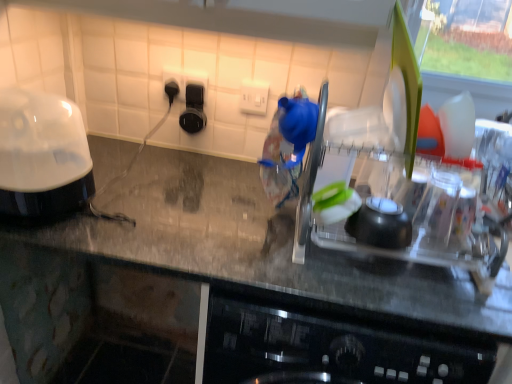
You are a GUI agent. You are given a task and a screenshot of the screen. Output one action in this format:
    pyautogui.click(x=<x>, y=<y>)
    Task: Click on the transparent plastic dish rack at center
    
    Given the screenshot: What is the action you would take?
    pyautogui.click(x=264, y=250)

The image size is (512, 384). What are the coordinates of `countertop that appears below the black plastic outlet at upper center, which ranks as the first electric outlet in left-to-right order (from a real-world perspective)` in the screenshot? It's located at (264, 250).

Is black plastic outlet at upper center, which ranks as the first electric outlet in left-to-right order, situated inside transparent plastic dish rack at center or outside?

black plastic outlet at upper center, which ranks as the first electric outlet in left-to-right order, exists outside the volume of transparent plastic dish rack at center.

Which is closer, (177, 76) or (262, 244)?

The point (262, 244) is in front.

Consider the image. Is black plastic outlet at upper center, which ranks as the first electric outlet in left-to-right order, facing towards transparent plastic dish rack at center?

No, black plastic outlet at upper center, which ranks as the first electric outlet in left-to-right order, is not turned towards transparent plastic dish rack at center.

Do you think black plastic outlet at upper center, which ranks as the first electric outlet in left-to-right order, is within clear plastic dish rack at center, or outside of it?

black plastic outlet at upper center, which ranks as the first electric outlet in left-to-right order, is spatially situated outside clear plastic dish rack at center.

How much distance is there between black plastic outlet at upper center, the second electric outlet viewed from the right, and clear plastic dish rack at center?

black plastic outlet at upper center, the second electric outlet viewed from the right, is 26.81 inches away from clear plastic dish rack at center.

Relative to clear plastic dish rack at center, is black plastic outlet at upper center, the second electric outlet viewed from the right, in front or behind?

In the image, black plastic outlet at upper center, the second electric outlet viewed from the right, appears behind clear plastic dish rack at center.

From a real-world perspective, which is physically below, black plastic outlet at upper center, the second electric outlet viewed from the right, or clear plastic dish rack at center?

clear plastic dish rack at center, from a real-world perspective.

In the image, is black glossy food processor at left positioned in front of or behind white plastic electric outlet at center, placed as the first electric outlet when sorted from right to left?

black glossy food processor at left is in front of white plastic electric outlet at center, placed as the first electric outlet when sorted from right to left.

Is black glossy food processor at left taller or shorter than white plastic electric outlet at center, placed as the first electric outlet when sorted from right to left?

Considering their sizes, black glossy food processor at left has more height than white plastic electric outlet at center, placed as the first electric outlet when sorted from right to left.

Looking at this image, choose the correct answer: Is black glossy food processor at left inside white plastic electric outlet at center, which is counted as the 2th electric outlet, starting from the left, or outside it?

black glossy food processor at left is spatially situated outside white plastic electric outlet at center, which is counted as the 2th electric outlet, starting from the left.

How many degrees apart are the facing directions of black glossy food processor at left and white plastic electric outlet at center, placed as the first electric outlet when sorted from right to left?

The angular difference between black glossy food processor at left and white plastic electric outlet at center, placed as the first electric outlet when sorted from right to left, is 0.51 degrees.

Who is bigger, white plastic electric outlet at center, placed as the first electric outlet when sorted from right to left, or clear plastic dish rack at center?

With larger size is clear plastic dish rack at center.

Between white plastic electric outlet at center, placed as the first electric outlet when sorted from right to left, and clear plastic dish rack at center, which one has more height?

Standing taller between the two is clear plastic dish rack at center.

Is white plastic electric outlet at center, which is counted as the 2th electric outlet, starting from the left, wider than clear plastic dish rack at center?

Incorrect, the width of white plastic electric outlet at center, which is counted as the 2th electric outlet, starting from the left, does not surpass that of clear plastic dish rack at center.

Looking at this image, from a real-world perspective, is white plastic electric outlet at center, which is counted as the 2th electric outlet, starting from the left, above or below transparent plastic dish rack at center?

From a real-world perspective, white plastic electric outlet at center, which is counted as the 2th electric outlet, starting from the left, is physically above transparent plastic dish rack at center.

Which is behind, point (259, 98) or point (234, 234)?

The point (259, 98) is farther from the camera.

Is black glossy food processor at left smaller than clear plastic dish rack at center?

Yes, black glossy food processor at left is smaller than clear plastic dish rack at center.

Does black glossy food processor at left turn towards clear plastic dish rack at center?

No, black glossy food processor at left is not turned towards clear plastic dish rack at center.

Locate an element on the screen. home appliance behind the clear plastic dish rack at center is located at coordinates (42, 155).

Which is behind, point (58, 207) or point (470, 237)?

The point (58, 207) is farther.

How different are the orientations of black glossy food processor at left and transparent plastic dish rack at center in degrees?

They differ by 0.846 degrees in their facing directions.

From a real-world perspective, is black glossy food processor at left positioned under transparent plastic dish rack at center based on gravity?

No, from a real-world perspective, black glossy food processor at left is not beneath transparent plastic dish rack at center.

Which of these two, black glossy food processor at left or transparent plastic dish rack at center, is thinner?

black glossy food processor at left.

Where is `the 1st electric outlet above the transparent plastic dish rack at center (from a real-world perspective)`? The height and width of the screenshot is (384, 512). the 1st electric outlet above the transparent plastic dish rack at center (from a real-world perspective) is located at coordinates (186, 79).

From the clear plastic dish rack at center, count the 2nd electric outlet to the left and point to it. Please provide its 2D coordinates.

[(186, 79)]

From the image, which object appears to be farther from clear plastic dish rack at center, black plastic outlet at upper center, which ranks as the first electric outlet in left-to-right order, or black glossy food processor at left?

Based on the image, black glossy food processor at left appears to be further to clear plastic dish rack at center.

Estimate the real-world distances between objects in this image. Which object is closer to clear plastic dish rack at center, transparent plastic dish rack at center or white plastic electric outlet at center, which is counted as the 2th electric outlet, starting from the left?

The object closer to clear plastic dish rack at center is transparent plastic dish rack at center.

Looking at the image, which one is located closer to transparent plastic dish rack at center, clear plastic dish rack at center or black plastic outlet at upper center, which ranks as the first electric outlet in left-to-right order?

clear plastic dish rack at center is closer to transparent plastic dish rack at center.

Consider the image. Which object lies nearer to the anchor point black glossy food processor at left, clear plastic dish rack at center or black plastic outlet at upper center, which ranks as the first electric outlet in left-to-right order?

The object closer to black glossy food processor at left is black plastic outlet at upper center, which ranks as the first electric outlet in left-to-right order.

Considering their positions, is black glossy food processor at left positioned further to clear plastic dish rack at center than black plastic outlet at upper center, the second electric outlet viewed from the right?

Based on the image, black glossy food processor at left appears to be further to clear plastic dish rack at center.

Based on their spatial positions, is black plastic outlet at upper center, which ranks as the first electric outlet in left-to-right order, or white plastic electric outlet at center, placed as the first electric outlet when sorted from right to left, further from transparent plastic dish rack at center?

Based on the image, black plastic outlet at upper center, which ranks as the first electric outlet in left-to-right order, appears to be further to transparent plastic dish rack at center.

Which object lies nearer to the anchor point black plastic outlet at upper center, the second electric outlet viewed from the right, clear plastic dish rack at center or white plastic electric outlet at center, which is counted as the 2th electric outlet, starting from the left?

Among the two, white plastic electric outlet at center, which is counted as the 2th electric outlet, starting from the left, is located nearer to black plastic outlet at upper center, the second electric outlet viewed from the right.

From the picture: From the image, which object appears to be nearer to clear plastic dish rack at center, white plastic electric outlet at center, which is counted as the 2th electric outlet, starting from the left, or black glossy food processor at left?

Based on the image, white plastic electric outlet at center, which is counted as the 2th electric outlet, starting from the left, appears to be nearer to clear plastic dish rack at center.

I want to click on appliance that lies between white plastic electric outlet at center, which is counted as the 2th electric outlet, starting from the left, and transparent plastic dish rack at center from top to bottom, so click(400, 206).

This screenshot has width=512, height=384. Identify the location of appliance that lies between black plastic outlet at upper center, the second electric outlet viewed from the right, and transparent plastic dish rack at center from top to bottom. (400, 206).

Where is `home appliance between black plastic outlet at upper center, the second electric outlet viewed from the right, and transparent plastic dish rack at center in the up-down direction`? home appliance between black plastic outlet at upper center, the second electric outlet viewed from the right, and transparent plastic dish rack at center in the up-down direction is located at coordinates (42, 155).

This screenshot has width=512, height=384. In order to click on electric outlet that lies between black plastic outlet at upper center, which ranks as the first electric outlet in left-to-right order, and transparent plastic dish rack at center from top to bottom in this screenshot , I will do `click(254, 97)`.